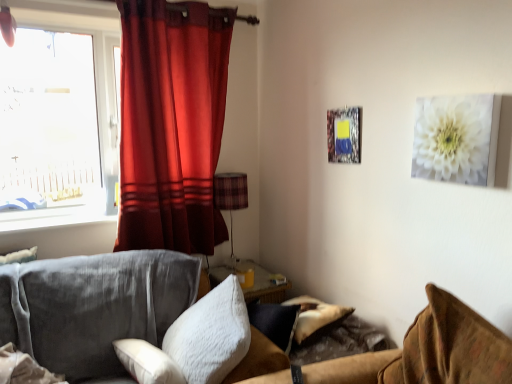
Question: From a real-world perspective, is white fluffy pillow at center, which is the first pillow in right-to-left order, positioned above or below white glossy window sill at left?

Choices:
 (A) above
 (B) below

Answer: (B)

Question: Looking at their shapes, would you say white fluffy pillow at center, which is the first pillow in right-to-left order, is wider or thinner than white glossy window sill at left?

Choices:
 (A) wide
 (B) thin

Answer: (A)

Question: Based on their relative distances, which object is farther from the white glossy window sill at left?

Choices:
 (A) white fluffy pillow at center, the second pillow viewed from the left
 (B) plaid fabric lampshade at center
 (C) white soft pillow at center, arranged as the 1th pillow when viewed from the left
 (D) velvet brown couch at lower right
 (E) white matte canvas at upper right

Answer: (E)

Question: Which is farther from the white matte canvas at upper right?

Choices:
 (A) transparent glass window at upper left
 (B) plaid fabric lampshade at center
 (C) velvet brown couch at lower right
 (D) white soft pillow at center, arranged as the 1th pillow when viewed from the left
 (E) satin red curtain at left

Answer: (A)